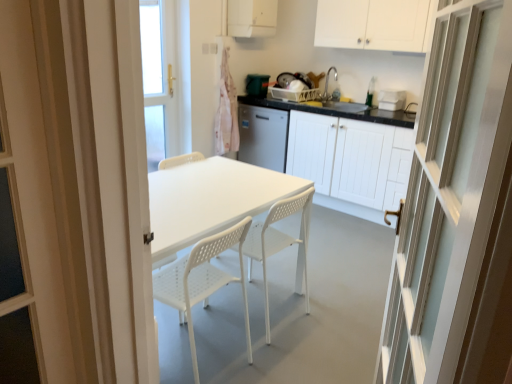
Image resolution: width=512 pixels, height=384 pixels. Describe the element at coordinates (202, 280) in the screenshot. I see `white plastic chair at center, which is the second chair in right-to-left order` at that location.

Identify the location of white plastic container at upper right, the first appliance positioned from the front. (392, 99).

Measure the distance between point (255, 88) and camera.

They are 4.32 meters apart.

The height and width of the screenshot is (384, 512). I want to click on green plastic bin at upper center, which ranks as the 2th appliance in right-to-left order, so click(257, 85).

What do you see at coordinates (372, 24) in the screenshot? The image size is (512, 384). I see `white matte cabinet at upper center, the second cabinetry positioned from the top` at bounding box center [372, 24].

Where is `white plastic chair at center, the 1th chair in the left-to-right sequence`? This screenshot has width=512, height=384. white plastic chair at center, the 1th chair in the left-to-right sequence is located at coordinates (202, 280).

Find the location of a particular element. Image resolution: width=512 pixels, height=384 pixels. cabinetry that is the 2nd one above the white plastic chair at center, which is the 1th chair from right to left (from a real-world perspective) is located at coordinates (372, 24).

Which object is thinner, white plastic chair at center, which appears as the second chair when viewed from the left, or white matte cabinet at upper center, which appears as the second cabinetry when ordered from the bottom?

Thinner between the two is white matte cabinet at upper center, which appears as the second cabinetry when ordered from the bottom.

Is white plastic chair at center, which is the 1th chair from right to left, far away from white matte cabinet at upper center, the second cabinetry positioned from the top?

That's right, there is a large distance between white plastic chair at center, which is the 1th chair from right to left, and white matte cabinet at upper center, the second cabinetry positioned from the top.

Is white plastic chair at center, which is the 1th chair from right to left, aimed at white matte cabinet at upper center, the second cabinetry positioned from the top?

No, white plastic chair at center, which is the 1th chair from right to left, is not aimed at white matte cabinet at upper center, the second cabinetry positioned from the top.

What are the coordinates of `chair behind the white plastic chair at center, which is the second chair in right-to-left order` in the screenshot? It's located at (277, 242).

From the image's perspective, which one is positioned higher, white plastic chair at center, which is the 1th chair from right to left, or white plastic chair at center, the 1th chair in the left-to-right sequence?

white plastic chair at center, which is the 1th chair from right to left, from the image's perspective.

Does point (269, 235) come closer to viewer compared to point (219, 282)?

No, (269, 235) is behind (219, 282).

Between white matte cabinet at upper center, the 1th cabinetry when ordered from top to bottom, and white matte cabinet at center, the 3th cabinetry from the top, which one is positioned behind?

white matte cabinet at upper center, the 1th cabinetry when ordered from top to bottom.

From the picture: Between white matte cabinet at upper center, the 1th cabinetry when ordered from top to bottom, and white matte cabinet at center, the 3th cabinetry from the top, which one appears on the right side from the viewer's perspective?

white matte cabinet at center, the 3th cabinetry from the top, is more to the right.

Could you tell me if white matte cabinet at upper center, the 1th cabinetry when ordered from top to bottom, is turned towards white matte cabinet at center, the 1th cabinetry positioned from the bottom?

No.

Is white matte cabinet at upper center, the 1th cabinetry when ordered from top to bottom, not close to white matte cabinet at center, the 3th cabinetry from the top?

Yes, white matte cabinet at upper center, the 1th cabinetry when ordered from top to bottom, and white matte cabinet at center, the 3th cabinetry from the top, are quite far apart.

In the image, is white matte cabinet at center, the 3th cabinetry from the top, on the left side or the right side of green plastic bin at upper center, which ranks as the 2th appliance in right-to-left order?

Based on their positions, white matte cabinet at center, the 3th cabinetry from the top, is located to the right of green plastic bin at upper center, which ranks as the 2th appliance in right-to-left order.

Is white matte cabinet at center, the 3th cabinetry from the top, facing towards green plastic bin at upper center, the 1th appliance positioned from the left?

No, white matte cabinet at center, the 3th cabinetry from the top, is not facing towards green plastic bin at upper center, the 1th appliance positioned from the left.

Is white matte cabinet at center, the 1th cabinetry positioned from the bottom, bigger or smaller than green plastic bin at upper center, which ranks as the 2th appliance in right-to-left order?

In the image, white matte cabinet at center, the 1th cabinetry positioned from the bottom, appears to be larger than green plastic bin at upper center, which ranks as the 2th appliance in right-to-left order.

Can you confirm if white plastic container at upper right, the 2th appliance when ordered from top to bottom, is positioned to the right of white plastic chair at center, which is the second chair in right-to-left order?

Yes.

Could you tell me if white plastic container at upper right, which is the 1th appliance from right to left, is turned towards white plastic chair at center, which is the second chair in right-to-left order?

Yes.

Can you confirm if white plastic container at upper right, arranged as the second appliance when viewed from the back, is shorter than white plastic chair at center, which is the second chair in right-to-left order?

Yes.

Can you tell me how much white plastic container at upper right, the 2th appliance from the left, and white plastic chair at center, the 1th chair in the left-to-right sequence, differ in facing direction?

90.6 degrees separate the facing orientations of white plastic container at upper right, the 2th appliance from the left, and white plastic chair at center, the 1th chair in the left-to-right sequence.

Considering the sizes of objects green plastic bin at upper center, which ranks as the 2th appliance in right-to-left order, and white plastic chair at center, which is the 1th chair from right to left, in the image provided, who is wider, green plastic bin at upper center, which ranks as the 2th appliance in right-to-left order, or white plastic chair at center, which is the 1th chair from right to left,?

Wider between the two is white plastic chair at center, which is the 1th chair from right to left.

Looking at this image, measure the distance from green plastic bin at upper center, positioned as the 2th appliance in front-to-back order, to white plastic chair at center, which appears as the second chair when viewed from the left.

green plastic bin at upper center, positioned as the 2th appliance in front-to-back order, is 7.45 feet from white plastic chair at center, which appears as the second chair when viewed from the left.

Based on the photo, from the image's perspective, which one is positioned lower, green plastic bin at upper center, which is the first appliance in back-to-front order, or white plastic chair at center, which appears as the second chair when viewed from the left?

white plastic chair at center, which appears as the second chair when viewed from the left, is shown below in the image.

In the scene shown: Can you tell me how much green plastic bin at upper center, the 1th appliance positioned from the left, and white plastic chair at center, which appears as the second chair when viewed from the left, differ in facing direction?

green plastic bin at upper center, the 1th appliance positioned from the left, and white plastic chair at center, which appears as the second chair when viewed from the left, are facing 90.6 degrees away from each other.

How many degrees apart are the facing directions of white plastic chair at center, which is the second chair in right-to-left order, and white matte cabinet at center, the 1th cabinetry positioned from the bottom?

They differ by 90.6 degrees in their facing directions.

Is point (215, 282) positioned behind point (248, 158)?

No.

Which of these two, white plastic chair at center, the 1th chair in the left-to-right sequence, or white matte cabinet at center, the 3th cabinetry from the top, is smaller?

Smaller between the two is white plastic chair at center, the 1th chair in the left-to-right sequence.

This screenshot has width=512, height=384. In order to click on chair that is the 1st one below the white matte cabinet at upper center, which appears as the second cabinetry when ordered from the bottom (from a real-world perspective) in this screenshot , I will do `click(277, 242)`.

In order to click on chair that is on the left side of white plastic chair at center, which appears as the second chair when viewed from the left in this screenshot , I will do `click(202, 280)`.

When comparing their distances from white plastic container at upper right, the first appliance positioned from the front, does green plastic bin at upper center, the first appliance in the top-to-bottom sequence, or white matte cabinet at upper center, the 3th cabinetry positioned from the bottom, seem further?

Based on the image, white matte cabinet at upper center, the 3th cabinetry positioned from the bottom, appears to be further to white plastic container at upper right, the first appliance positioned from the front.

Considering their positions, is white plastic container at upper right, the 2th appliance when ordered from top to bottom, positioned further to white plastic chair at center, the 1th chair in the left-to-right sequence, than white glossy door at right?

white plastic container at upper right, the 2th appliance when ordered from top to bottom, lies further to white plastic chair at center, the 1th chair in the left-to-right sequence, than the other object.

From the image, which object appears to be farther from white matte cabinet at upper center, the 1th cabinetry when ordered from top to bottom, white matte cabinet at upper center, which appears as the second cabinetry when ordered from the bottom, or white matte cabinet at center, the 3th cabinetry from the top?

white matte cabinet at center, the 3th cabinetry from the top, is further to white matte cabinet at upper center, the 1th cabinetry when ordered from top to bottom.

Which object lies further to the anchor point white matte cabinet at center, the 1th cabinetry positioned from the bottom, white matte cabinet at upper center, the second cabinetry positioned from the top, or white plastic chair at center, which appears as the second chair when viewed from the left?

white plastic chair at center, which appears as the second chair when viewed from the left, is further to white matte cabinet at center, the 1th cabinetry positioned from the bottom.

Estimate the real-world distances between objects in this image. Which object is closer to white plastic chair at center, the 1th chair in the left-to-right sequence, white matte cabinet at upper center, the 3th cabinetry positioned from the bottom, or white plastic chair at center, which appears as the second chair when viewed from the left?

white plastic chair at center, which appears as the second chair when viewed from the left.

Based on their spatial positions, is white matte cabinet at center, the 1th cabinetry positioned from the bottom, or white matte cabinet at upper center, the 3th cabinetry positioned from the bottom, further from white plastic container at upper right, the 1th appliance from the bottom?

Based on the image, white matte cabinet at upper center, the 3th cabinetry positioned from the bottom, appears to be further to white plastic container at upper right, the 1th appliance from the bottom.

Which object lies further to the anchor point white plastic container at upper right, the 1th appliance from the bottom, white plastic chair at center, which is the second chair in right-to-left order, or green plastic bin at upper center, positioned as the 2th appliance in front-to-back order?

white plastic chair at center, which is the second chair in right-to-left order.

From the image, which object appears to be nearer to green plastic bin at upper center, which ranks as the 2th appliance in right-to-left order, white matte cabinet at upper center, the 3th cabinetry positioned from the bottom, or white plastic chair at center, which is the 1th chair from right to left?

white matte cabinet at upper center, the 3th cabinetry positioned from the bottom, is positioned closer to the anchor green plastic bin at upper center, which ranks as the 2th appliance in right-to-left order.

The width and height of the screenshot is (512, 384). Find the location of `appliance positioned between white plastic chair at center, the 1th chair in the left-to-right sequence, and white matte cabinet at upper center, the 1th cabinetry when ordered from top to bottom, from near to far`. appliance positioned between white plastic chair at center, the 1th chair in the left-to-right sequence, and white matte cabinet at upper center, the 1th cabinetry when ordered from top to bottom, from near to far is located at coordinates (392, 99).

The height and width of the screenshot is (384, 512). Identify the location of appliance between white plastic chair at center, the 1th chair in the left-to-right sequence, and green plastic bin at upper center, positioned as the 2th appliance in front-to-back order, from front to back. (392, 99).

Find the location of a particular element. This screenshot has height=384, width=512. appliance situated between white matte cabinet at upper center, the 1th cabinetry when ordered from top to bottom, and white matte cabinet at upper center, which appears as the second cabinetry when ordered from the bottom, from left to right is located at coordinates (257, 85).

Where is `cabinetry between white matte cabinet at upper center, which appears as the second cabinetry when ordered from the bottom, and white plastic chair at center, which appears as the second chair when viewed from the left, from top to bottom`? Image resolution: width=512 pixels, height=384 pixels. cabinetry between white matte cabinet at upper center, which appears as the second cabinetry when ordered from the bottom, and white plastic chair at center, which appears as the second chair when viewed from the left, from top to bottom is located at coordinates (339, 158).